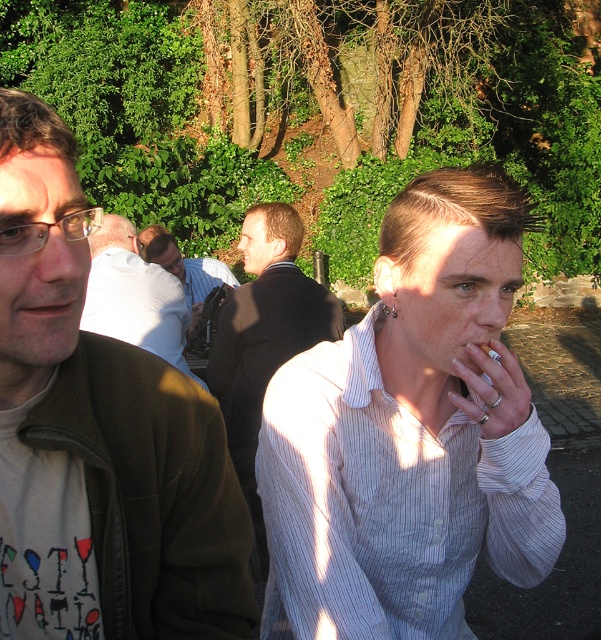
Can you confirm if white striped shirt at center is shorter than matte brown jacket at left?

Incorrect, white striped shirt at center's height does not fall short of matte brown jacket at left's.

Between point (486, 493) and point (120, 368), which one is positioned behind?

The point (486, 493) is behind.

You are a GUI agent. You are given a task and a screenshot of the screen. Output one action in this format:
    pyautogui.click(x=<x>, y=<y>)
    Task: Click on the white striped shirt at center
    This screenshot has width=601, height=640.
    Given the screenshot: What is the action you would take?
    pyautogui.click(x=409, y=433)

Can you confirm if white shirt at center is positioned to the right of dark brown leather jacket at center?

Indeed, white shirt at center is positioned on the right side of dark brown leather jacket at center.

Is white shirt at center above dark brown leather jacket at center?

No.

Is point (93, 275) positioned in front of point (197, 259)?

Yes.

Find the location of a particular element. The height and width of the screenshot is (640, 601). white shirt at center is located at coordinates (133, 296).

Can you confirm if dark suit jacket at center is smaller than dark brown leather jacket at center?

Yes.

Is point (225, 333) more distant than point (191, 321)?

No.

Where is `dark suit jacket at center`? The height and width of the screenshot is (640, 601). dark suit jacket at center is located at coordinates (264, 337).